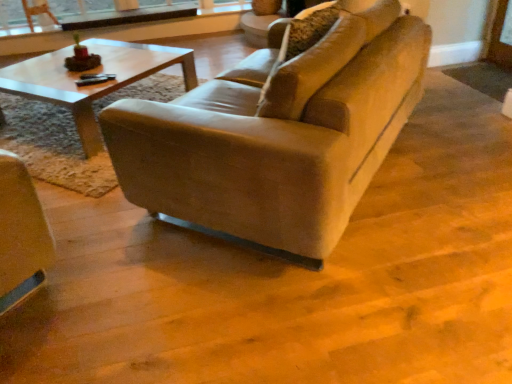
Question: From the image's perspective, is leather couch at center on top of clear glass window frame at upper center?

Choices:
 (A) yes
 (B) no

Answer: (B)

Question: Does leather couch at center have a lesser height compared to clear glass window frame at upper center?

Choices:
 (A) no
 (B) yes

Answer: (A)

Question: Can you confirm if leather couch at center is taller than clear glass window frame at upper center?

Choices:
 (A) yes
 (B) no

Answer: (A)

Question: Is leather couch at center further to the viewer compared to clear glass window frame at upper center?

Choices:
 (A) no
 (B) yes

Answer: (A)

Question: Can you confirm if leather couch at center is smaller than clear glass window frame at upper center?

Choices:
 (A) no
 (B) yes

Answer: (A)

Question: Can you confirm if leather couch at center is thinner than clear glass window frame at upper center?

Choices:
 (A) no
 (B) yes

Answer: (A)

Question: Can we say leather couch at center lies outside matte brown armchair at upper left?

Choices:
 (A) yes
 (B) no

Answer: (A)

Question: From a real-world perspective, is leather couch at center beneath matte brown armchair at upper left?

Choices:
 (A) yes
 (B) no

Answer: (B)

Question: Is leather couch at center to the left of matte brown armchair at upper left from the viewer's perspective?

Choices:
 (A) no
 (B) yes

Answer: (A)

Question: Is the depth of leather couch at center less than that of matte brown armchair at upper left?

Choices:
 (A) no
 (B) yes

Answer: (B)

Question: Is leather couch at center taller than matte brown armchair at upper left?

Choices:
 (A) no
 (B) yes

Answer: (B)

Question: Is leather couch at center thinner than matte brown armchair at upper left?

Choices:
 (A) yes
 (B) no

Answer: (B)

Question: Can you confirm if clear glass window frame at upper center is taller than matte brown armchair at upper left?

Choices:
 (A) yes
 (B) no

Answer: (B)